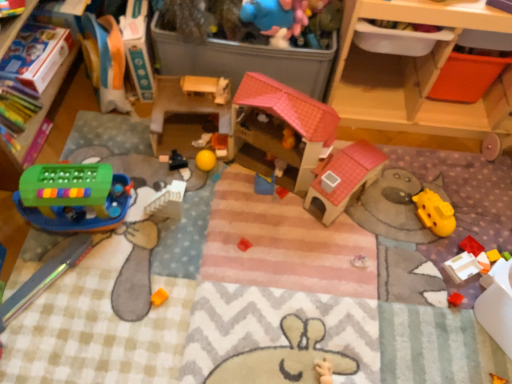
The width and height of the screenshot is (512, 384). Find the location of `vacant space to the right of yellow rubber ball at center, which is counted as the fifth toy, starting from the left`. vacant space to the right of yellow rubber ball at center, which is counted as the fifth toy, starting from the left is located at coordinates (243, 168).